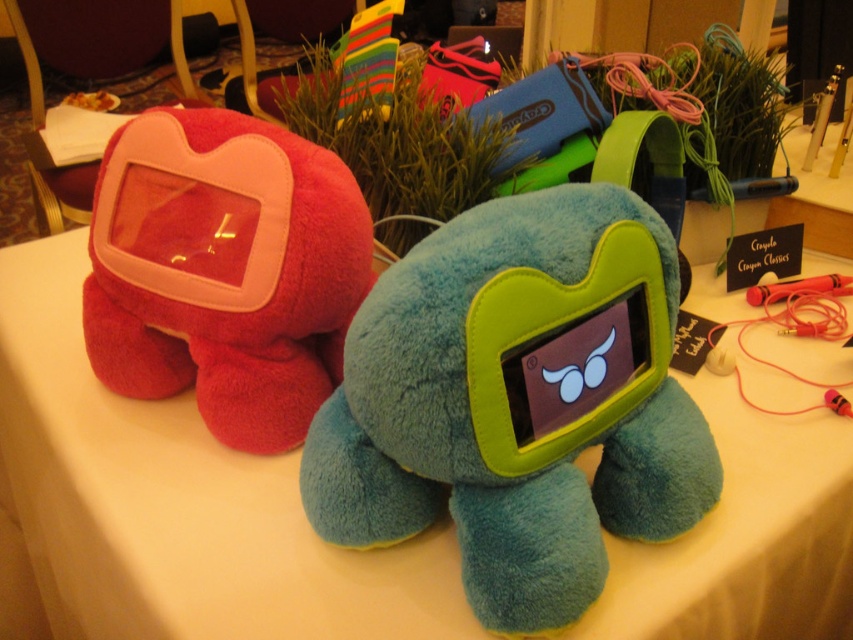
Who is lower down, white cloth at center or teal plush toy at center?

Positioned lower is white cloth at center.

Is white cloth at center to the left of teal plush toy at center from the viewer's perspective?

Correct, you'll find white cloth at center to the left of teal plush toy at center.

What do you see at coordinates (177, 502) in the screenshot? I see `white cloth at center` at bounding box center [177, 502].

Locate an element on the screen. Image resolution: width=853 pixels, height=640 pixels. white cloth at center is located at coordinates (177, 502).

Between point (676, 433) and point (347, 234), which one is positioned behind?

Positioned behind is point (347, 234).

Is point (585, 189) less distant than point (247, 237)?

That is True.

Identify the location of teal plush toy at center. Image resolution: width=853 pixels, height=640 pixels. (473, 428).

Which of these two, white cloth at center or matte pink plush at left, stands taller?

white cloth at center is taller.

In the scene shown: How far apart are white cloth at center and matte pink plush at left?

They are 21.32 centimeters apart.

Between point (109, 486) and point (86, 330), which one is positioned in front?

Positioned in front is point (109, 486).

Image resolution: width=853 pixels, height=640 pixels. What are the coordinates of `white cloth at center` in the screenshot? It's located at (177, 502).